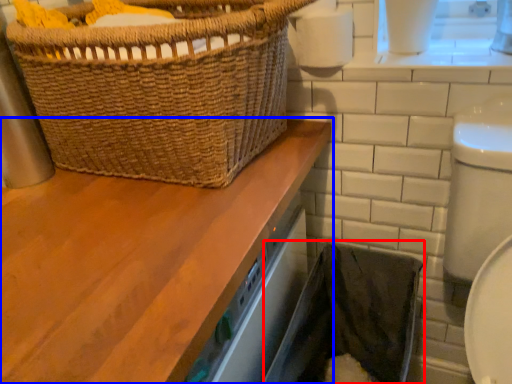
Question: Among these objects, which one is farthest to the camera, laundry basket (highlighted by a red box) or bathroom cabinet (highlighted by a blue box)?

Choices:
 (A) laundry basket
 (B) bathroom cabinet

Answer: (A)